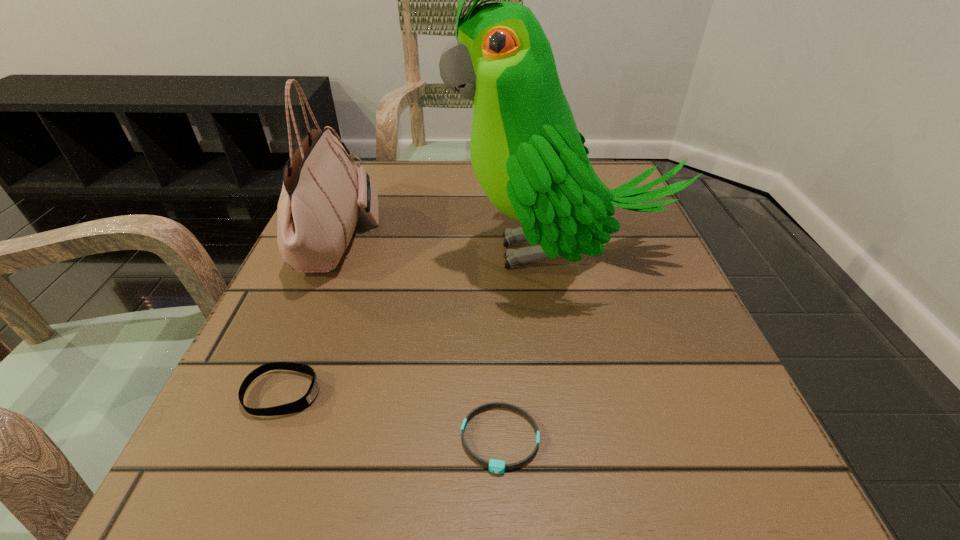
Identify the location of vacant space at the far edge. The width and height of the screenshot is (960, 540). (440, 171).

Where is `vacant space at the left edge of the desktop`? vacant space at the left edge of the desktop is located at coordinates (260, 426).

Locate an element on the screen. This screenshot has width=960, height=540. vacant region at the right edge of the desktop is located at coordinates (701, 384).

Identify the location of empty space that is in between the taller wristband and the third shortest object. (311, 316).

At what (x,y) coordinates should I click in order to perform the action: click on vacant region between the second tallest object and the left wristband. Please return your answer as a coordinate pair (x, y). The height and width of the screenshot is (540, 960). Looking at the image, I should click on point(311,316).

Locate an element on the screen. This screenshot has height=540, width=960. free space between the shortest object and the tallest object is located at coordinates (529, 346).

The height and width of the screenshot is (540, 960). Find the location of `blank region between the tallest object and the taller wristband`. blank region between the tallest object and the taller wristband is located at coordinates (420, 323).

I want to click on free area in between the right wristband and the tallest object, so click(x=529, y=346).

Locate an element on the screen. The height and width of the screenshot is (540, 960). free area in between the tallest object and the second tallest object is located at coordinates (448, 246).

Find the location of a particular element. free space between the handbag and the taller wristband is located at coordinates (311, 316).